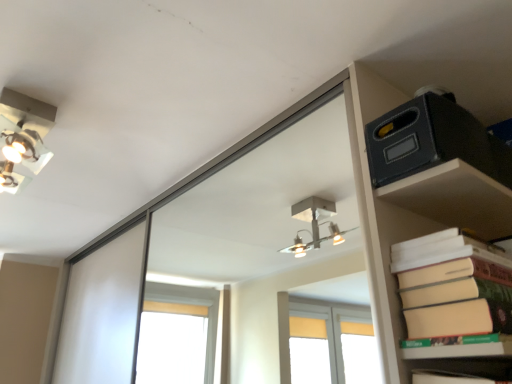
Question: Can you confirm if beige matte paper at right is taller than matte black box at upper right?

Choices:
 (A) yes
 (B) no

Answer: (A)

Question: Is beige matte paper at right wider than matte black box at upper right?

Choices:
 (A) no
 (B) yes

Answer: (A)

Question: From a real-world perspective, is beige matte paper at right beneath matte black box at upper right?

Choices:
 (A) yes
 (B) no

Answer: (A)

Question: Can we say beige matte paper at right lies outside matte black box at upper right?

Choices:
 (A) yes
 (B) no

Answer: (A)

Question: Is beige matte paper at right next to matte black box at upper right and touching it?

Choices:
 (A) yes
 (B) no

Answer: (B)

Question: In the image, is metallic silver light fixture at upper left positioned in front of or behind matte black box at upper right?

Choices:
 (A) behind
 (B) front

Answer: (A)

Question: From the image's perspective, is metallic silver light fixture at upper left above or below matte black box at upper right?

Choices:
 (A) below
 (B) above

Answer: (B)

Question: Is metallic silver light fixture at upper left taller or shorter than matte black box at upper right?

Choices:
 (A) short
 (B) tall

Answer: (B)

Question: In terms of size, does metallic silver light fixture at upper left appear bigger or smaller than matte black box at upper right?

Choices:
 (A) big
 (B) small

Answer: (B)

Question: Choose the correct answer: Is metallic silver light fixture at upper left inside beige matte paper at right or outside it?

Choices:
 (A) outside
 (B) inside

Answer: (A)

Question: Considering the positions of metallic silver light fixture at upper left and beige matte paper at right in the image, is metallic silver light fixture at upper left wider or thinner than beige matte paper at right?

Choices:
 (A) wide
 (B) thin

Answer: (A)

Question: Considering the positions of point (30, 157) and point (456, 319), is point (30, 157) closer or farther from the camera than point (456, 319)?

Choices:
 (A) farther
 (B) closer

Answer: (A)

Question: In the image, is metallic silver light fixture at upper left positioned in front of or behind beige matte paper at right?

Choices:
 (A) front
 (B) behind

Answer: (B)

Question: Considering the relative positions of beige matte paper at right and matte black box at upper right in the image provided, is beige matte paper at right to the left or to the right of matte black box at upper right?

Choices:
 (A) right
 (B) left

Answer: (A)

Question: In terms of width, does beige matte paper at right look wider or thinner when compared to matte black box at upper right?

Choices:
 (A) wide
 (B) thin

Answer: (B)